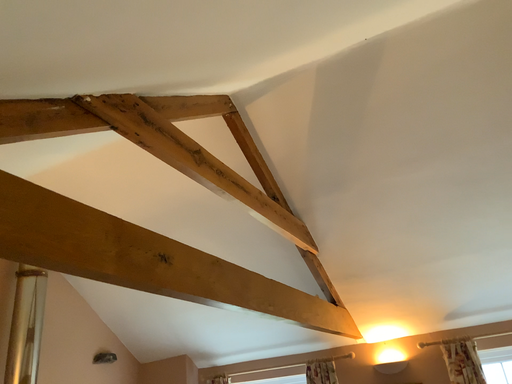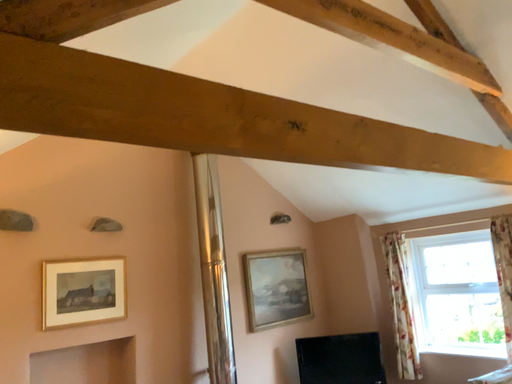
Question: How did the camera likely rotate when shooting the video?

Choices:
 (A) rotated upward
 (B) rotated downward

Answer: (B)